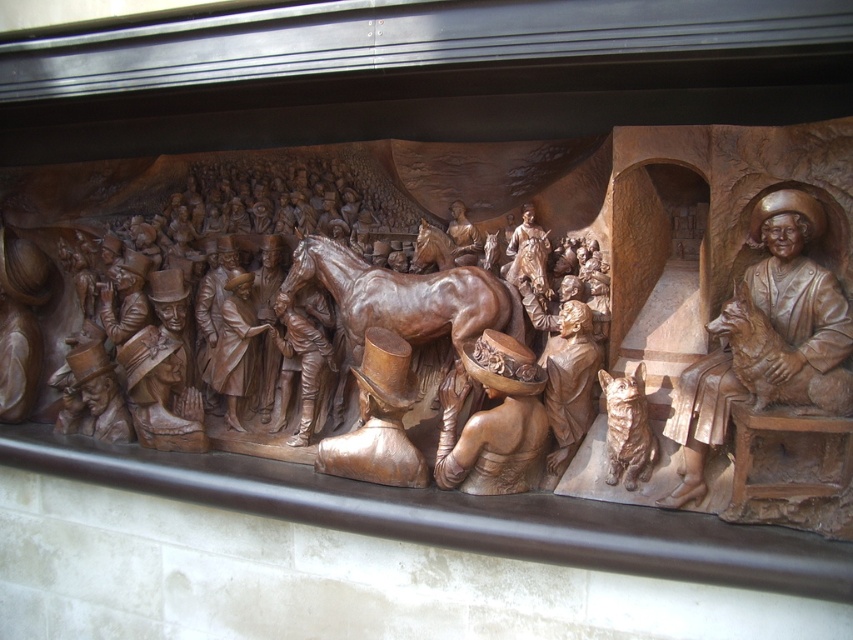
You are an art conservator examining the bronze relief sculpture. You notice the polished brown horse at center and the wooden hat at center. Which object appears closer to you in the relief?

The polished brown horse at center appears closer to you than the wooden hat at center because it is further to the viewer in the relief.

You are an art conservator examining the bronze relief sculpture. You need to locate the bronze statue of man with dog at right for restoration. Based on the coordinates provided, where exactly is this statue positioned on the relief?

The bronze statue of man with dog at right is located at point coordinates of [766,340].

Looking at the bronze relief sculpture, you notice the polished brown horse at center and the wooden hat at center. Which object is taller?

The polished brown horse at center is much taller than the wooden hat at center.